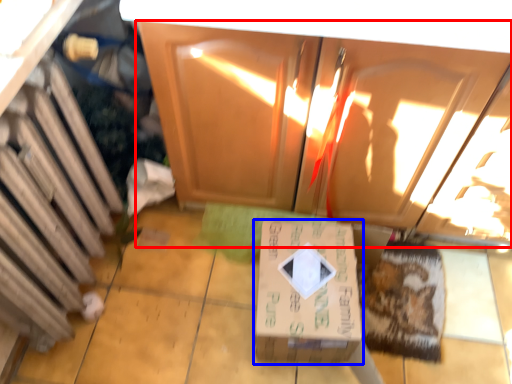
Question: Which object is further to the camera taking this photo, cabinetry (highlighted by a red box) or box (highlighted by a blue box)?

Choices:
 (A) cabinetry
 (B) box

Answer: (B)